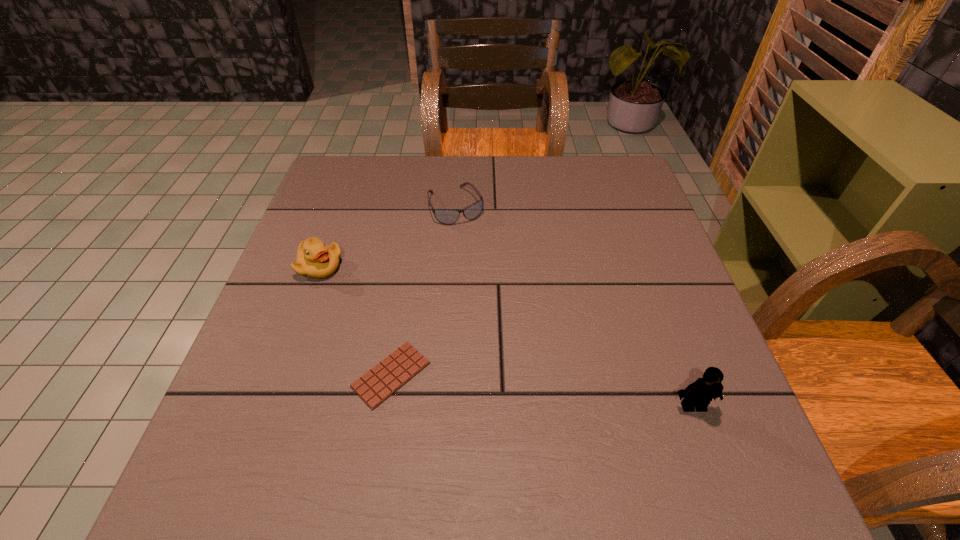
In the image, there is a desktop. Where is `vacant space at the far edge`? vacant space at the far edge is located at coordinates (379, 201).

The width and height of the screenshot is (960, 540). What are the coordinates of `free space at the near edge of the desktop` in the screenshot? It's located at (396, 434).

The image size is (960, 540). In the image, there is a desktop. Identify the location of free space at the right edge. (613, 288).

This screenshot has height=540, width=960. Find the location of `vacant region at the far left corner of the desktop`. vacant region at the far left corner of the desktop is located at coordinates (329, 175).

This screenshot has width=960, height=540. In the image, there is a desktop. What are the coordinates of `vacant space at the near left corner` in the screenshot? It's located at (231, 393).

Where is `free spot between the third nearest object and the tallest object`? The image size is (960, 540). free spot between the third nearest object and the tallest object is located at coordinates point(507,336).

Identify the location of free space between the third nearest object and the candy bar. This screenshot has height=540, width=960. (356, 321).

Locate an element on the screen. This screenshot has width=960, height=540. free space between the third tallest object and the tallest object is located at coordinates pyautogui.click(x=574, y=306).

Find the location of a particular element. This screenshot has height=540, width=960. empty location between the rightmost object and the shortest object is located at coordinates (542, 390).

This screenshot has width=960, height=540. In order to click on empty space between the shortest object and the Lego in this screenshot , I will do `click(542, 390)`.